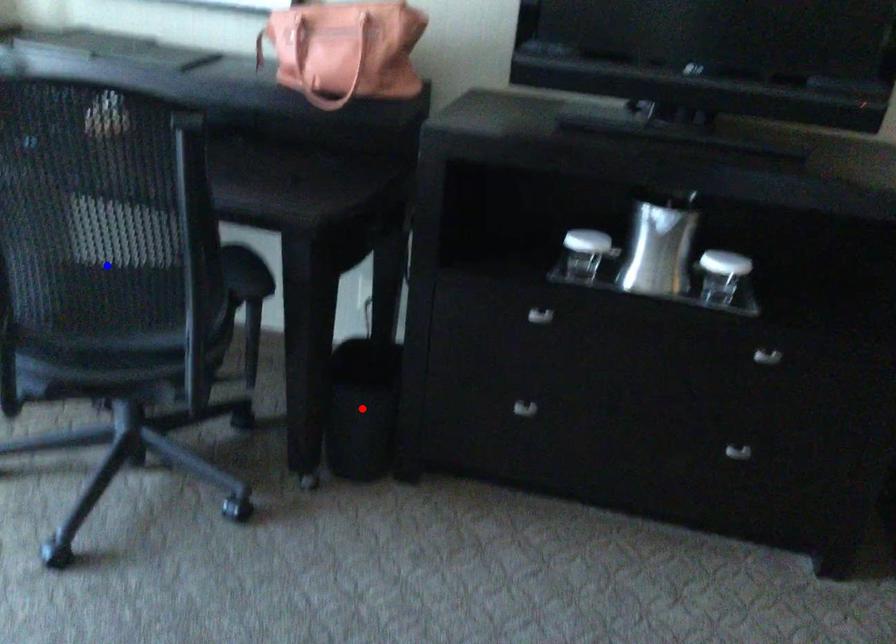
Question: In the image, two points are highlighted. Which point is nearer to the camera? Reply with the corresponding letter.

Choices:
 (A) blue point
 (B) red point

Answer: (A)